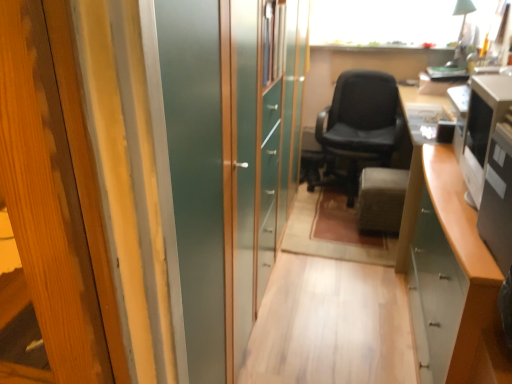
Question: Based on their positions, is black glossy desktop computer at right, which is counted as the 2th desktop computer, starting from the back, located to the left or right of satin silver monitor at right, positioned as the 1th desktop computer in back-to-front order?

Choices:
 (A) right
 (B) left

Answer: (B)

Question: Is black glossy desktop computer at right, which is the 1th desktop computer in front-to-back order, in front of or behind satin silver monitor at right, positioned as the 1th desktop computer in back-to-front order, in the image?

Choices:
 (A) front
 (B) behind

Answer: (A)

Question: Estimate the real-world distances between objects in this image. Which object is farther from the satin silver monitor at right, positioned as the 1th desktop computer in back-to-front order?

Choices:
 (A) velvet gray ottoman at center
 (B) black leather chair at center
 (C) white glossy cabinet at lower right
 (D) black glossy desktop computer at right, which is counted as the 2th desktop computer, starting from the back

Answer: (B)

Question: Estimate the real-world distances between objects in this image. Which object is closer to the velvet gray ottoman at center?

Choices:
 (A) black glossy desktop computer at right, which is the 1th desktop computer in front-to-back order
 (B) black leather chair at center
 (C) white glossy cabinet at lower right
 (D) satin silver monitor at right, positioned as the 1th desktop computer in back-to-front order

Answer: (B)